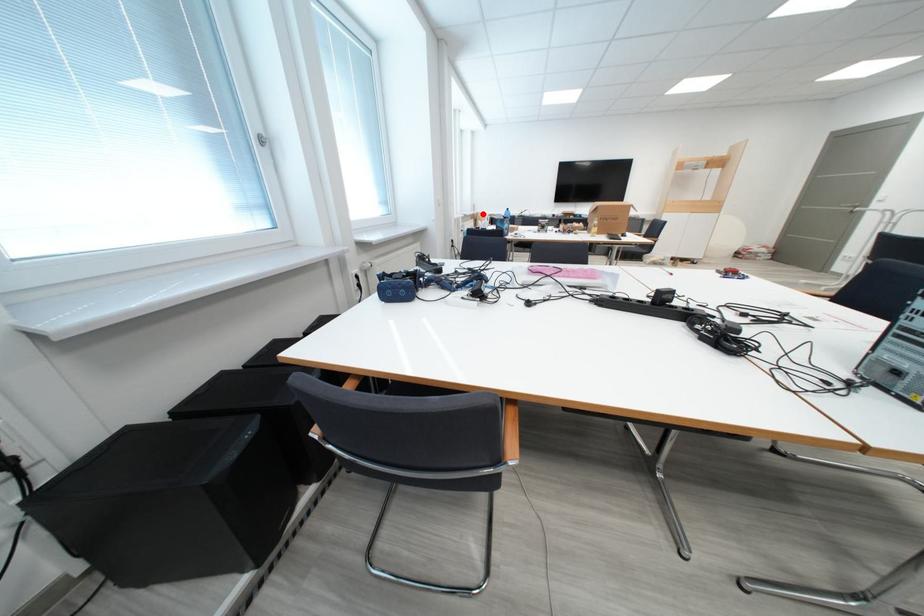
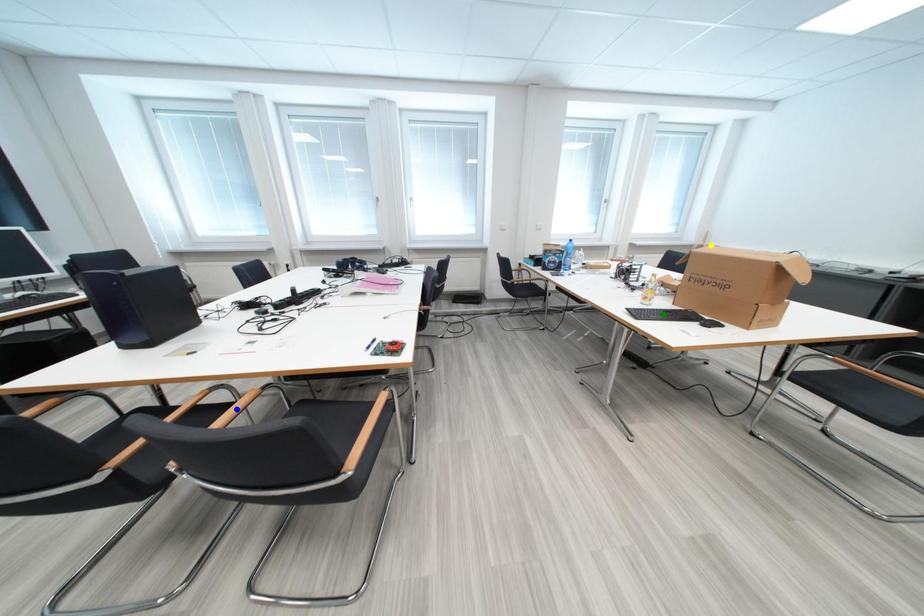
Question: I am providing you with two images of the same scene from different viewpoints. A red point is marked on the first image. You are given multiple points on the second image. Which point in image 2 is actually the same real-world point as the red point in image 1?

Choices:
 (A) yellow point
 (B) green point
 (C) blue point

Answer: (A)